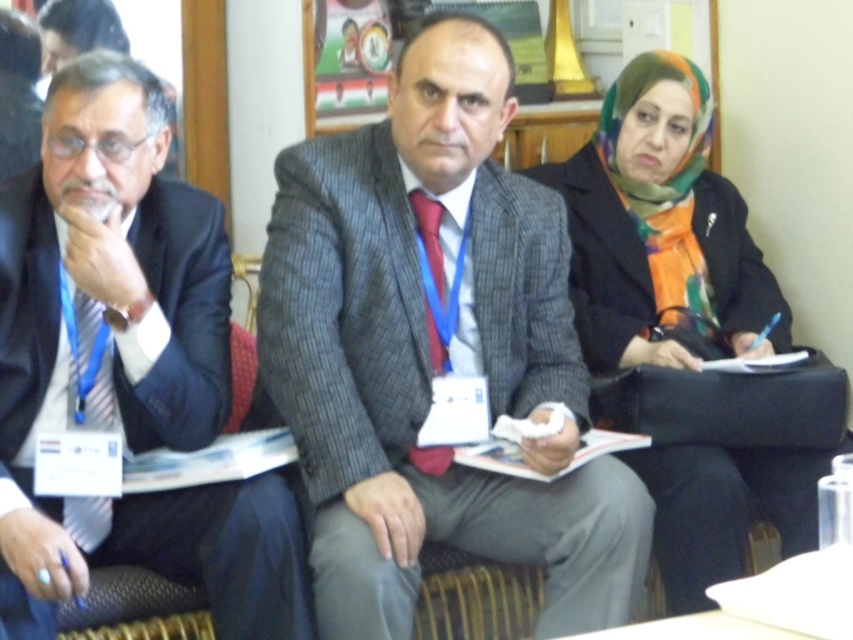
Question: Which object appears closest to the camera in this image?

Choices:
 (A) textured gray suit at center
 (B) multicolored scarf at right
 (C) matte black suit at left

Answer: (C)

Question: Considering the relative positions of textured gray suit at center and matte black suit at left in the image provided, where is textured gray suit at center located with respect to matte black suit at left?

Choices:
 (A) right
 (B) left

Answer: (A)

Question: Which point appears closest to the camera in this image?

Choices:
 (A) (381, 186)
 (B) (227, 586)
 (C) (717, 509)

Answer: (B)

Question: Is matte black suit at left thinner than multicolored scarf at right?

Choices:
 (A) no
 (B) yes

Answer: (B)

Question: Can you confirm if textured gray suit at center is positioned to the left of multicolored scarf at right?

Choices:
 (A) yes
 (B) no

Answer: (A)

Question: Which of the following is the closest to the observer?

Choices:
 (A) (621, 150)
 (B) (482, 307)

Answer: (B)